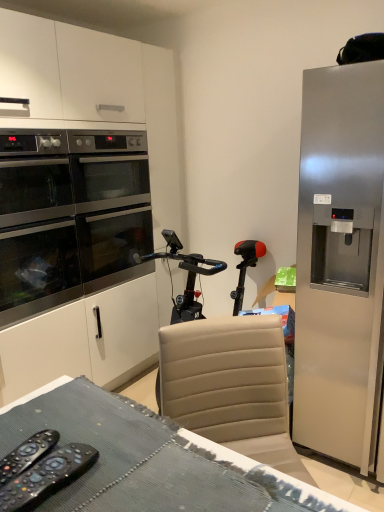
Where is `vacant space behind black plastic remote control at lower left, which ranks as the first remote control in left-to-right order`? The width and height of the screenshot is (384, 512). vacant space behind black plastic remote control at lower left, which ranks as the first remote control in left-to-right order is located at coordinates (52, 416).